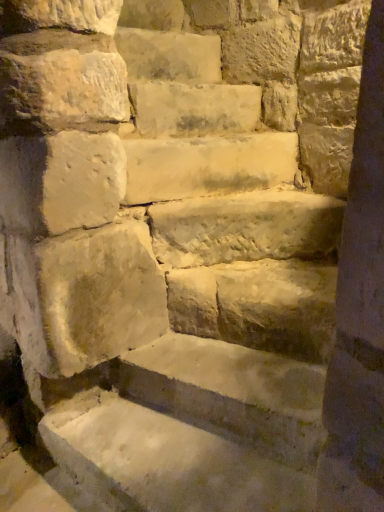
Question: Is smooth beige stone at center located outside smooth beige stone steps at center?

Choices:
 (A) no
 (B) yes

Answer: (B)

Question: From the image's perspective, is smooth beige stone at center beneath smooth beige stone steps at center?

Choices:
 (A) no
 (B) yes

Answer: (A)

Question: Can you confirm if smooth beige stone at center is positioned to the left of smooth beige stone steps at center?

Choices:
 (A) yes
 (B) no

Answer: (A)

Question: Can you confirm if smooth beige stone at center is wider than smooth beige stone steps at center?

Choices:
 (A) no
 (B) yes

Answer: (A)

Question: Is smooth beige stone at center facing away from smooth beige stone steps at center?

Choices:
 (A) no
 (B) yes

Answer: (A)

Question: Is smooth beige stone at center positioned before smooth beige stone steps at center?

Choices:
 (A) no
 (B) yes

Answer: (A)

Question: Is smooth beige stone at center facing towards light beige stone at upper center, marked as the 1th brick in a top-to-bottom arrangement?

Choices:
 (A) no
 (B) yes

Answer: (A)

Question: Is the position of smooth beige stone at center more distant than that of light beige stone at upper center, marked as the 1th brick in a top-to-bottom arrangement?

Choices:
 (A) no
 (B) yes

Answer: (A)

Question: Does smooth beige stone at center appear on the left side of light beige stone at upper center, marked as the 1th brick in a top-to-bottom arrangement?

Choices:
 (A) no
 (B) yes

Answer: (A)

Question: Does smooth beige stone at center have a smaller size compared to light beige stone at upper center, marked as the 1th brick in a top-to-bottom arrangement?

Choices:
 (A) yes
 (B) no

Answer: (A)

Question: Is smooth beige stone at center positioned with its back to light beige stone at upper center, the second brick in the bottom-to-top sequence?

Choices:
 (A) yes
 (B) no

Answer: (B)

Question: Is smooth beige stone at center bigger than light beige stone at upper center, the second brick in the bottom-to-top sequence?

Choices:
 (A) yes
 (B) no

Answer: (B)

Question: From the image's perspective, is light beige stone at center, which is the first brick in bottom-to-top order, under smooth beige stone steps at center?

Choices:
 (A) yes
 (B) no

Answer: (B)